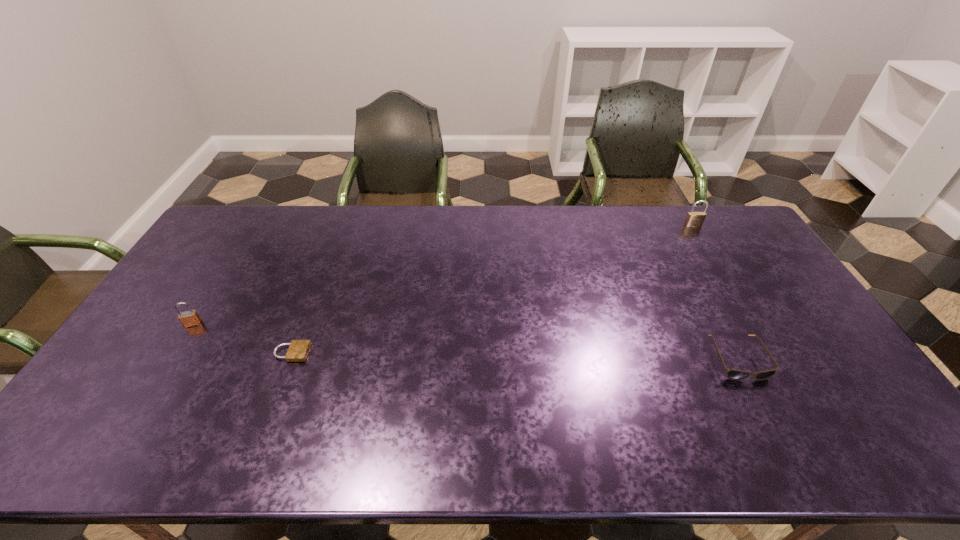
Find the location of a particular element. the farthest padlock is located at coordinates (694, 219).

Identify the location of the tallest padlock. (694, 219).

Image resolution: width=960 pixels, height=540 pixels. Find the location of `the leftmost padlock`. the leftmost padlock is located at coordinates (189, 318).

I want to click on the leftmost object, so click(x=189, y=318).

Where is `the third tallest object`? Image resolution: width=960 pixels, height=540 pixels. the third tallest object is located at coordinates (732, 374).

You are a GUI agent. You are given a task and a screenshot of the screen. Output one action in this format:
    pyautogui.click(x=<x>, y=<y>)
    Task: Click on the second padlock from left to right
    Image resolution: width=960 pixels, height=540 pixels.
    Given the screenshot: What is the action you would take?
    pyautogui.click(x=298, y=350)

At what (x,y) coordinates should I click in order to perform the action: click on the shortest padlock. Please return your answer as a coordinate pair (x, y). The width and height of the screenshot is (960, 540). Looking at the image, I should click on (298, 350).

You are a GUI agent. You are given a task and a screenshot of the screen. Output one action in this format:
    pyautogui.click(x=<x>, y=<y>)
    Task: Click on the free space located 0.260m on the front-facing side of the tallest padlock
    The image size is (960, 540).
    Given the screenshot: What is the action you would take?
    pyautogui.click(x=722, y=274)

Locate an element on the screen. The image size is (960, 540). blank space located on the left of the third nearest object is located at coordinates (158, 323).

This screenshot has width=960, height=540. In order to click on vacant region located 0.080m on the lenses of the sunglasses in this screenshot , I will do `click(763, 409)`.